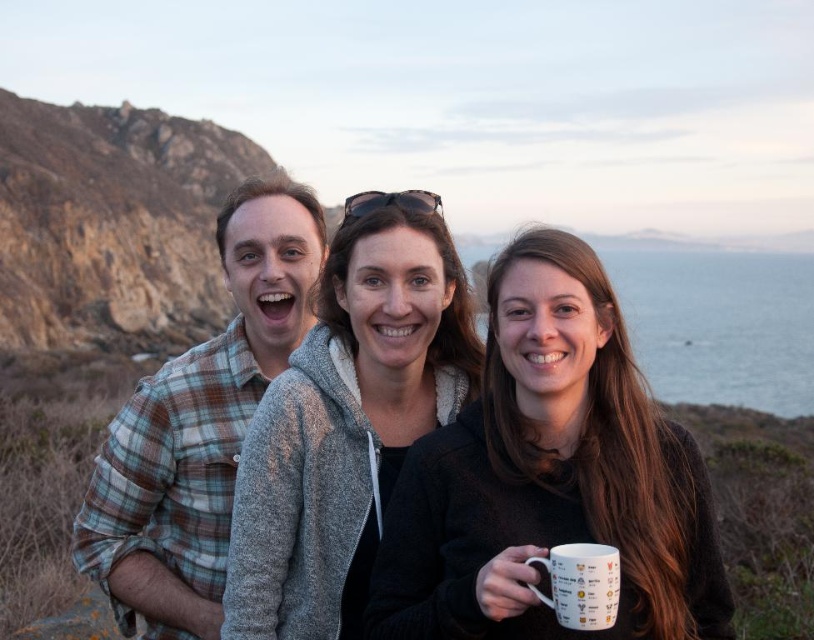
In the scene shown: Who is positioned more to the left, plaid flannel shirt at left or white ceramic mug at lower right?

From the viewer's perspective, plaid flannel shirt at left appears more on the left side.

Is plaid flannel shirt at left above white ceramic mug at lower right?

Correct, plaid flannel shirt at left is located above white ceramic mug at lower right.

Locate an element on the screen. plaid flannel shirt at left is located at coordinates (199, 426).

Who is more forward, (226, 596) or (143, 531)?

Point (226, 596)

Does gray fleece jacket at center appear on the right side of plaid flannel shirt at left?

Yes, gray fleece jacket at center is to the right of plaid flannel shirt at left.

Between point (298, 512) and point (129, 512), which one is positioned in front?

Point (298, 512) is more forward.

This screenshot has height=640, width=814. What are the coordinates of `gray fleece jacket at center` in the screenshot? It's located at (346, 422).

From the picture: Between gray fleece jacket at center and white ceramic mug at lower right, which one is positioned higher?

gray fleece jacket at center

Can you confirm if gray fleece jacket at center is positioned to the right of white ceramic mug at lower right?

No, gray fleece jacket at center is not to the right of white ceramic mug at lower right.

From the picture: Who is more distant from viewer, (349, 305) or (576, 595)?

The point (349, 305) is behind.

Image resolution: width=814 pixels, height=640 pixels. What are the coordinates of `gray fleece jacket at center` in the screenshot? It's located at (346, 422).